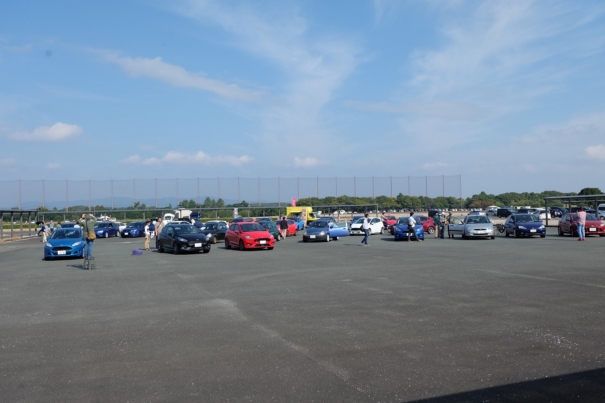
You are a GUI agent. You are given a task and a screenshot of the screen. Output one action in this format:
    pyautogui.click(x=<x>, y=<y>)
    Task: Click on the open door
    The width and height of the screenshot is (605, 403).
    Given the screenshot: What is the action you would take?
    coord(455,229), coord(339,229)